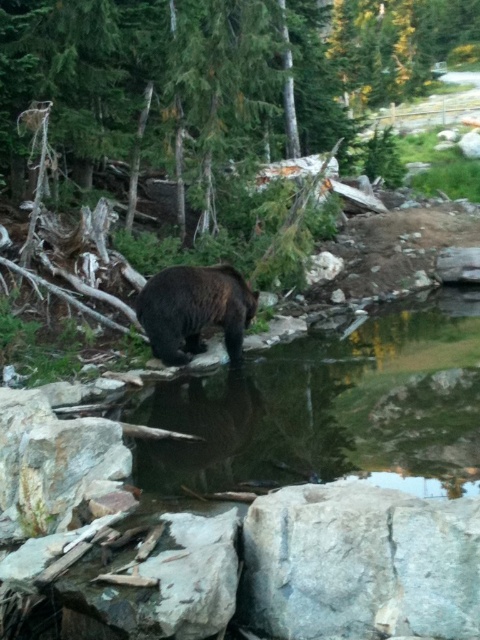
Is green textured tree at center bigger than brown furry bear at center?

Yes, green textured tree at center is bigger than brown furry bear at center.

Can you confirm if green textured tree at center is shorter than brown furry bear at center?

In fact, green textured tree at center may be taller than brown furry bear at center.

The width and height of the screenshot is (480, 640). What are the coordinates of `green textured tree at center` in the screenshot? It's located at (212, 76).

Is point (98, 129) positioned before point (144, 400)?

No, it is not.

Does green textured tree at center lie in front of transparent water at center?

That is False.

Which is behind, point (85, 164) or point (424, 320)?

The point (85, 164) is behind.

Find the location of a particular element. This screenshot has width=480, height=640. green textured tree at center is located at coordinates (212, 76).

Can you confirm if transparent water at center is smaller than brown furry bear at center?

No.

The height and width of the screenshot is (640, 480). What do you see at coordinates (330, 406) in the screenshot?
I see `transparent water at center` at bounding box center [330, 406].

Locate an element on the screen. This screenshot has width=480, height=640. transparent water at center is located at coordinates (330, 406).